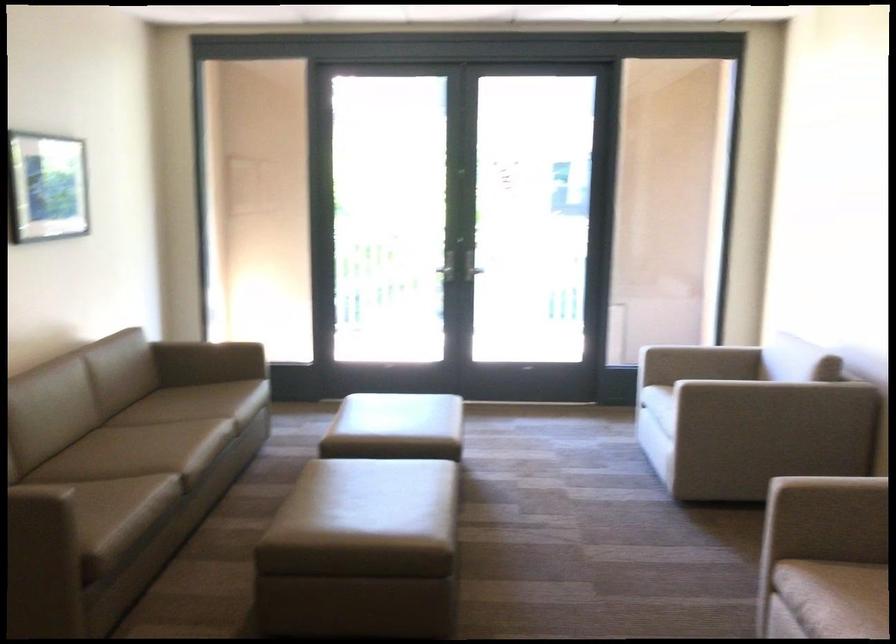
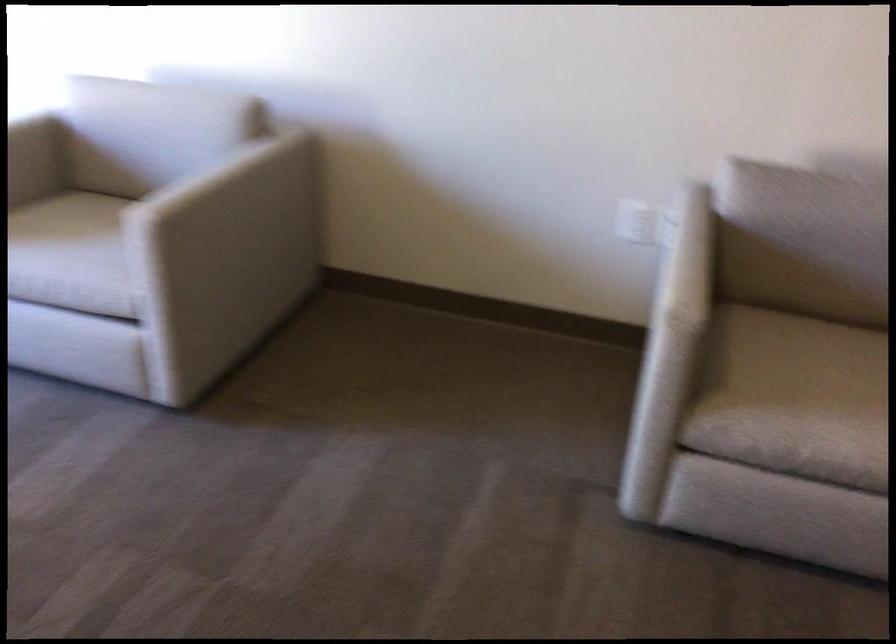
Question: I am providing you with two images of the same scene from different viewpoints. Which of the following objects are not visible in image2?

Choices:
 (A) chair armrest
 (B) chair sitting surface
 (C) white power outlet
 (D) none of these

Answer: (D)